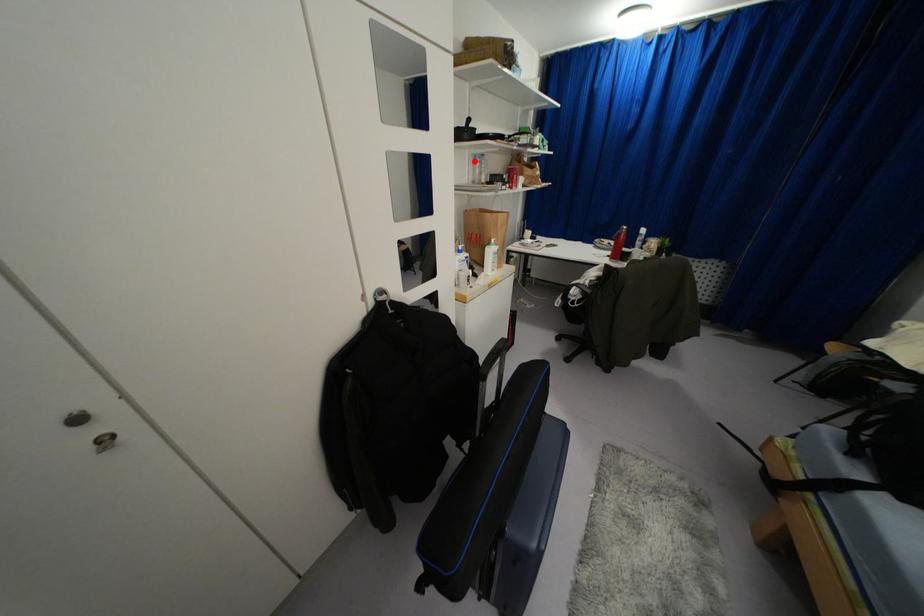
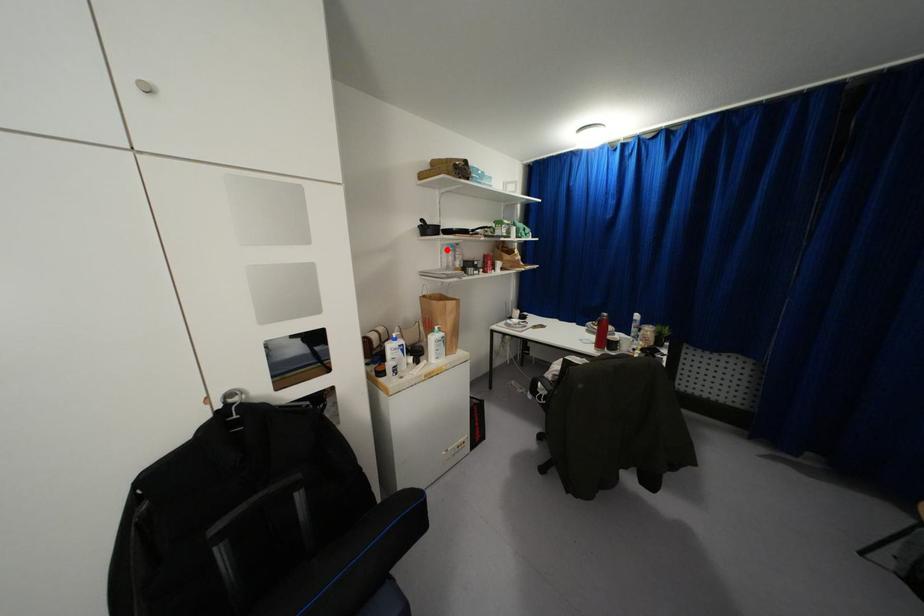
I am providing you with two images of the same scene from different viewpoints. A red point is marked on the first image and another point is marked on the second image. Do the highlighted points in image1 and image2 indicate the same real-world spot?

Yes